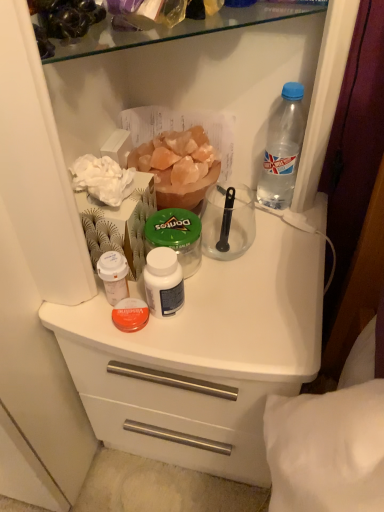
Where is `vacant area that lies between transparent plastic bottle at upper right, the 2th bottle ordered from the bottom, and orange crystal salt at center`? The height and width of the screenshot is (512, 384). vacant area that lies between transparent plastic bottle at upper right, the 2th bottle ordered from the bottom, and orange crystal salt at center is located at coordinates (239, 209).